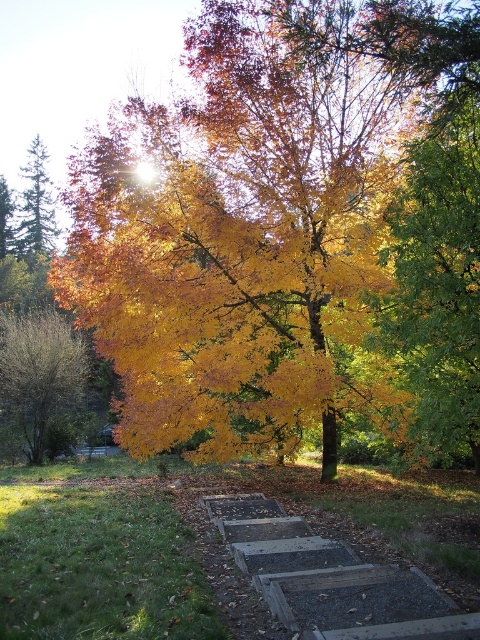
Consider the image. You are standing at the point with coordinates point (324,595) and want to walk towards the point with coordinates point (51,340). Which direction should you move to get closer to your destination?

To move from point (324,595) towards point (51,340), you should move downward and to the left since the destination point is located below and to the left of the starting point.

You are an artist planning to paint the autumn scene. You want to ensure the brown textured bush at left and the green matte evergreen tree at left are proportionally accurate. Which object should you paint smaller to maintain the correct size relationship?

The brown textured bush at left should be painted smaller than the green matte evergreen tree at left since it occupies less space according to the description.

You are standing on the pathway and want to place a small garden statue between the brown textured bush at left and the green matte evergreen tree at left. Which object should you place the statue closer to if you want it to be closer to the shorter plant?

The brown textured bush at left is shorter than the green matte evergreen tree at left, so you should place the statue closer to the brown textured bush at left to be near the shorter plant.